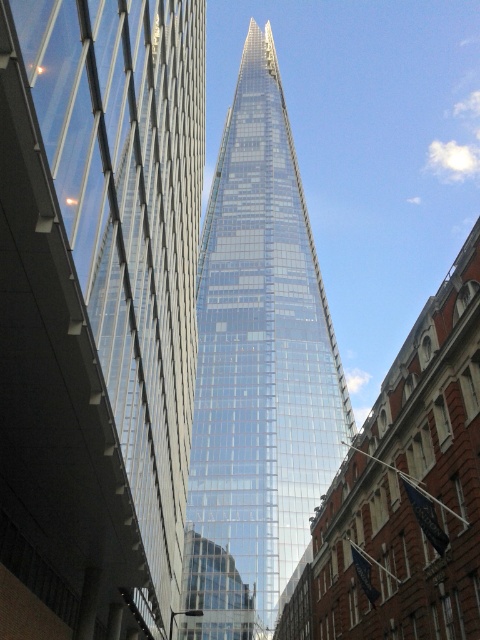
Question: Can you confirm if transparent glass skyscraper at center is positioned to the right of transparent glass tower at center?

Choices:
 (A) yes
 (B) no

Answer: (B)

Question: Can you confirm if transparent glass skyscraper at center is positioned to the right of transparent glass tower at center?

Choices:
 (A) yes
 (B) no

Answer: (B)

Question: Which of the following is the closest to the observer?

Choices:
 (A) transparent glass skyscraper at center
 (B) transparent glass tower at center

Answer: (A)

Question: Is transparent glass skyscraper at center below transparent glass tower at center?

Choices:
 (A) no
 (B) yes

Answer: (B)